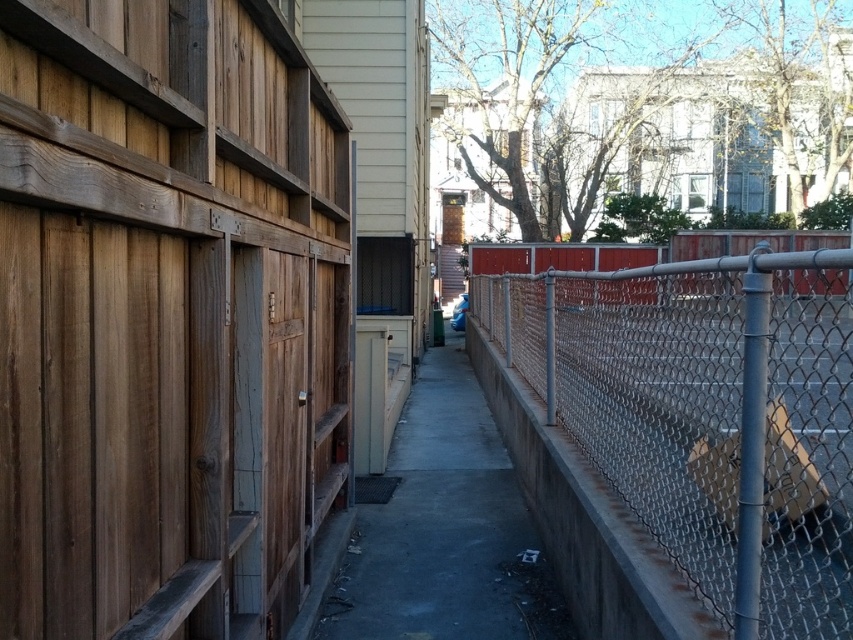
Which of these two, rusty chain-link fence at right or gray concrete pavement at center, stands shorter?

Standing shorter between the two is gray concrete pavement at center.

Is point (830, 595) positioned behind point (409, 572)?

No, it is not.

Identify the location of rusty chain-link fence at right. (708, 416).